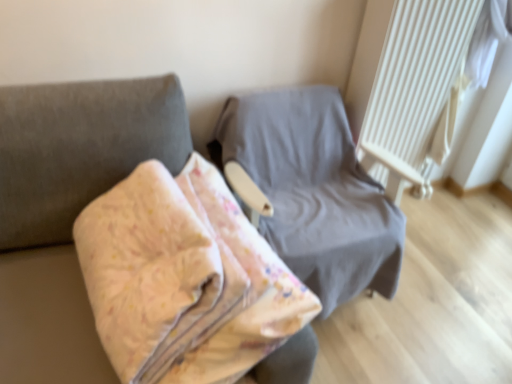
What is the approximate width of floral fabric blanket at center, the 1th furniture when ordered from front to back?

The width of floral fabric blanket at center, the 1th furniture when ordered from front to back, is 26.19 inches.

Measure the distance between gray fabric chair at center, the 1th furniture in the back-to-front sequence, and camera.

The distance of gray fabric chair at center, the 1th furniture in the back-to-front sequence, from camera is 4.27 feet.

I want to click on floral fabric blanket at center, the 1th furniture when ordered from front to back, so click(x=80, y=149).

In the scene shown: How far apart are gray fabric chair at center, the 2th furniture from the front, and white textured radiator at upper right?

gray fabric chair at center, the 2th furniture from the front, and white textured radiator at upper right are 12.07 inches apart from each other.

Looking at this image, which object is positioned more to the left, gray fabric chair at center, the 2th furniture from the front, or white textured radiator at upper right?

gray fabric chair at center, the 2th furniture from the front, is more to the left.

Locate an element on the screen. The image size is (512, 384). radiator that appears behind the gray fabric chair at center, the 1th furniture in the back-to-front sequence is located at coordinates (414, 90).

Is gray fabric chair at center, the 2th furniture from the front, taller or shorter than white textured radiator at upper right?

Clearly, gray fabric chair at center, the 2th furniture from the front, is shorter compared to white textured radiator at upper right.

Is floral fabric blanket at center, the 1th furniture when ordered from front to back, completely or partially outside of gray fabric chair at center, the 2th furniture from the front?

That's correct, floral fabric blanket at center, the 1th furniture when ordered from front to back, is outside of gray fabric chair at center, the 2th furniture from the front.

From the image's perspective, would you say floral fabric blanket at center, the 1th furniture when ordered from front to back, is shown under gray fabric chair at center, the 2th furniture from the front?

Yes, from the image's perspective, floral fabric blanket at center, the 1th furniture when ordered from front to back, is below gray fabric chair at center, the 2th furniture from the front.

From a real-world perspective, is floral fabric blanket at center, arranged as the second furniture when viewed from the back, positioned under gray fabric chair at center, the 2th furniture from the front, based on gravity?

No, from a real-world perspective, floral fabric blanket at center, arranged as the second furniture when viewed from the back, is not below gray fabric chair at center, the 2th furniture from the front.

Considering the relative sizes of floral fabric blanket at center, the 1th furniture when ordered from front to back, and white textured radiator at upper right in the image provided, is floral fabric blanket at center, the 1th furniture when ordered from front to back, thinner than white textured radiator at upper right?

Incorrect, the width of floral fabric blanket at center, the 1th furniture when ordered from front to back, is not less than that of white textured radiator at upper right.

Can you confirm if floral fabric blanket at center, arranged as the second furniture when viewed from the back, is smaller than white textured radiator at upper right?

Incorrect, floral fabric blanket at center, arranged as the second furniture when viewed from the back, is not smaller in size than white textured radiator at upper right.

Which is in front, point (281, 376) or point (389, 136)?

Positioned in front is point (281, 376).

Considering the relative positions of floral fabric blanket at center, arranged as the second furniture when viewed from the back, and white textured radiator at upper right in the image provided, is floral fabric blanket at center, arranged as the second furniture when viewed from the back, to the left or to the right of white textured radiator at upper right?

Based on their positions, floral fabric blanket at center, arranged as the second furniture when viewed from the back, is located to the left of white textured radiator at upper right.

Can you confirm if white textured radiator at upper right is shorter than gray fabric chair at center, the 2th furniture from the front?

No, white textured radiator at upper right is not shorter than gray fabric chair at center, the 2th furniture from the front.

Considering the relative sizes of white textured radiator at upper right and gray fabric chair at center, the 2th furniture from the front, in the image provided, is white textured radiator at upper right thinner than gray fabric chair at center, the 2th furniture from the front,?

Yes.

Can you tell me how much white textured radiator at upper right and gray fabric chair at center, the 1th furniture in the back-to-front sequence, differ in facing direction?

The angular difference between white textured radiator at upper right and gray fabric chair at center, the 1th furniture in the back-to-front sequence, is 90.6 degrees.

Is gray fabric chair at center, the 1th furniture in the back-to-front sequence, facing towards floral fabric blanket at center, arranged as the second furniture when viewed from the back?

Yes, gray fabric chair at center, the 1th furniture in the back-to-front sequence, is turned towards floral fabric blanket at center, arranged as the second furniture when viewed from the back.

Does gray fabric chair at center, the 2th furniture from the front, have a lesser height compared to floral fabric blanket at center, arranged as the second furniture when viewed from the back?

No, gray fabric chair at center, the 2th furniture from the front, is not shorter than floral fabric blanket at center, arranged as the second furniture when viewed from the back.

Consider the image. How far apart are gray fabric chair at center, the 1th furniture in the back-to-front sequence, and floral fabric blanket at center, arranged as the second furniture when viewed from the back?

The distance of gray fabric chair at center, the 1th furniture in the back-to-front sequence, from floral fabric blanket at center, arranged as the second furniture when viewed from the back, is 20.75 inches.

Is gray fabric chair at center, the 1th furniture in the back-to-front sequence, next to floral fabric blanket at center, arranged as the second furniture when viewed from the back?

No.

Between white textured radiator at upper right and floral fabric blanket at center, the 1th furniture when ordered from front to back, which one has smaller size?

With smaller size is white textured radiator at upper right.

You are a GUI agent. You are given a task and a screenshot of the screen. Output one action in this format:
    pyautogui.click(x=<x>, y=<y>)
    Task: Click on the 2nd furniture in front when counting from the white textured radiator at upper right
    The image size is (512, 384).
    Given the screenshot: What is the action you would take?
    pyautogui.click(x=80, y=149)

Is white textured radiator at upper right outside of floral fabric blanket at center, the 1th furniture when ordered from front to back?

Yes, white textured radiator at upper right is not within floral fabric blanket at center, the 1th furniture when ordered from front to back.

Locate an element on the screen. The height and width of the screenshot is (384, 512). radiator behind the gray fabric chair at center, the 1th furniture in the back-to-front sequence is located at coordinates (414, 90).

Find the location of a particular element. The width and height of the screenshot is (512, 384). furniture to the left of gray fabric chair at center, the 2th furniture from the front is located at coordinates (80, 149).

From the picture: Looking at the image, which one is located further to floral fabric blanket at center, the 1th furniture when ordered from front to back, white textured radiator at upper right or gray fabric chair at center, the 1th furniture in the back-to-front sequence?

white textured radiator at upper right is further to floral fabric blanket at center, the 1th furniture when ordered from front to back.

From the image, which object appears to be farther from floral fabric blanket at center, the 1th furniture when ordered from front to back, gray fabric chair at center, the 2th furniture from the front, or white textured radiator at upper right?

white textured radiator at upper right is positioned further to the anchor floral fabric blanket at center, the 1th furniture when ordered from front to back.

Estimate the real-world distances between objects in this image. Which object is further from gray fabric chair at center, the 2th furniture from the front, floral fabric blanket at center, arranged as the second furniture when viewed from the back, or white textured radiator at upper right?

Based on the image, floral fabric blanket at center, arranged as the second furniture when viewed from the back, appears to be further to gray fabric chair at center, the 2th furniture from the front.

From the image, which object appears to be nearer to white textured radiator at upper right, gray fabric chair at center, the 1th furniture in the back-to-front sequence, or floral fabric blanket at center, the 1th furniture when ordered from front to back?

Based on the image, gray fabric chair at center, the 1th furniture in the back-to-front sequence, appears to be nearer to white textured radiator at upper right.

Looking at the image, which one is located further to gray fabric chair at center, the 1th furniture in the back-to-front sequence, white textured radiator at upper right or floral fabric blanket at center, the 1th furniture when ordered from front to back?

floral fabric blanket at center, the 1th furniture when ordered from front to back, is further to gray fabric chair at center, the 1th furniture in the back-to-front sequence.

From the picture: Based on their spatial positions, is floral fabric blanket at center, arranged as the second furniture when viewed from the back, or gray fabric chair at center, the 2th furniture from the front, further from white textured radiator at upper right?

Among the two, floral fabric blanket at center, arranged as the second furniture when viewed from the back, is located further to white textured radiator at upper right.

Find the location of `furniture between floral fabric blanket at center, the 1th furniture when ordered from front to back, and white textured radiator at upper right from left to right`. furniture between floral fabric blanket at center, the 1th furniture when ordered from front to back, and white textured radiator at upper right from left to right is located at coordinates (314, 191).